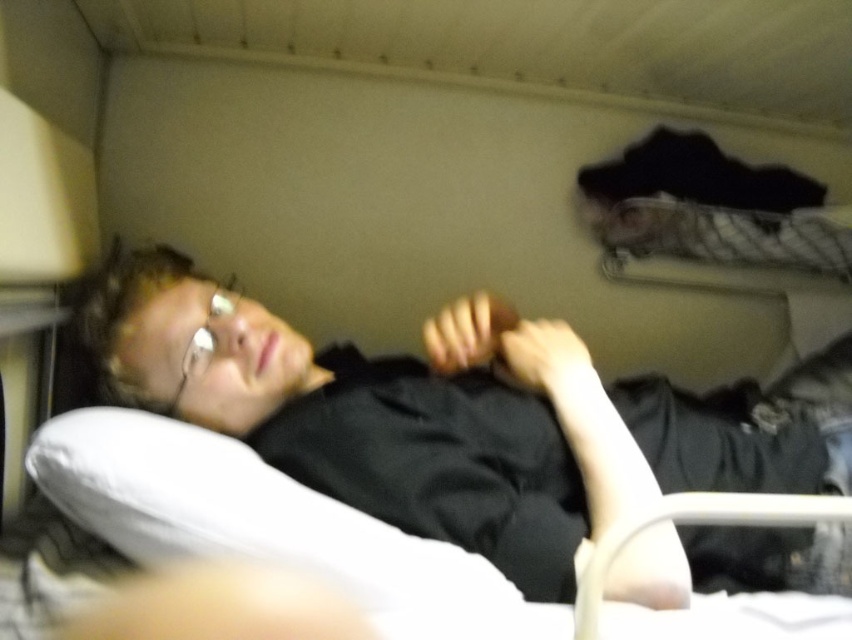
You are trying to place a rectangular object that is 15 cm wide on the bed. The black matte shirt at center and the white soft pillow at lower left are already on the bed. Can you fit the object between them without overlapping?

The black matte shirt at center might be wider than the white soft pillow at lower left, so there may not be enough space between them to fit a 15 cm wide object without overlapping. Check the actual dimensions to be sure.

You are a traveler who wants to place a 6.5 inch wide book between the black matte shirt at center and the white soft pillow at lower left. Can you fit the book in that space?

The black matte shirt at center and the white soft pillow at lower left are 7.02 inches apart, so the 6.5 inch wide book can fit between them since it is narrower than the space available.